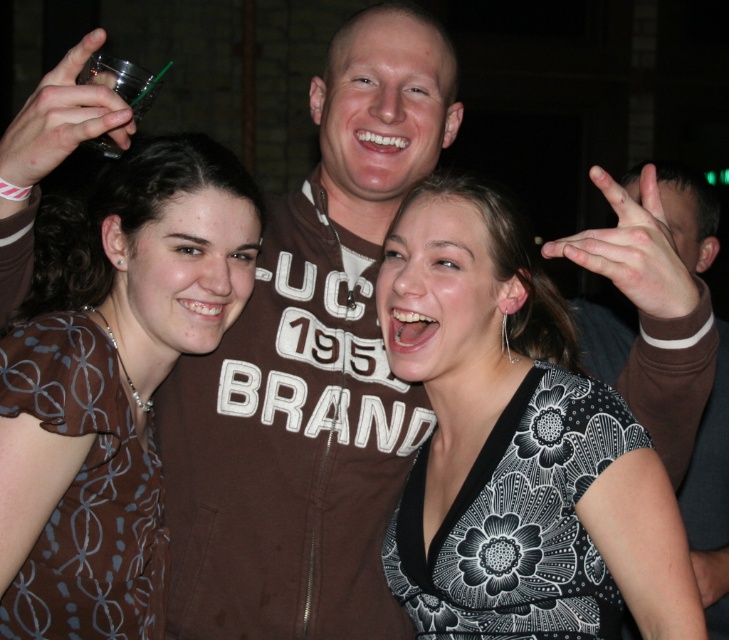
Question: Can you confirm if black floral dress at center is thinner than brown printed dress at center?

Choices:
 (A) no
 (B) yes

Answer: (A)

Question: Is black floral dress at center positioned behind clear plastic cup at upper left?

Choices:
 (A) no
 (B) yes

Answer: (B)

Question: Which object is closer to the camera taking this photo?

Choices:
 (A) brown printed dress at center
 (B) clear plastic cup at upper left

Answer: (B)

Question: Which point appears closest to the camera in this image?

Choices:
 (A) (89, 72)
 (B) (601, 403)

Answer: (A)

Question: Which point appears farthest from the camera in this image?

Choices:
 (A) (472, 317)
 (B) (28, 369)
 (C) (101, 54)

Answer: (A)

Question: From the image, what is the correct spatial relationship of black floral dress at center in relation to brown printed dress at center?

Choices:
 (A) left
 (B) right

Answer: (B)